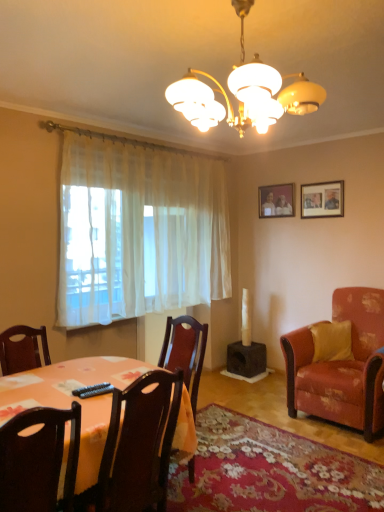
The image size is (384, 512). What are the coordinates of `free point to the left of black plastic remote control at lower center` in the screenshot? It's located at (54, 395).